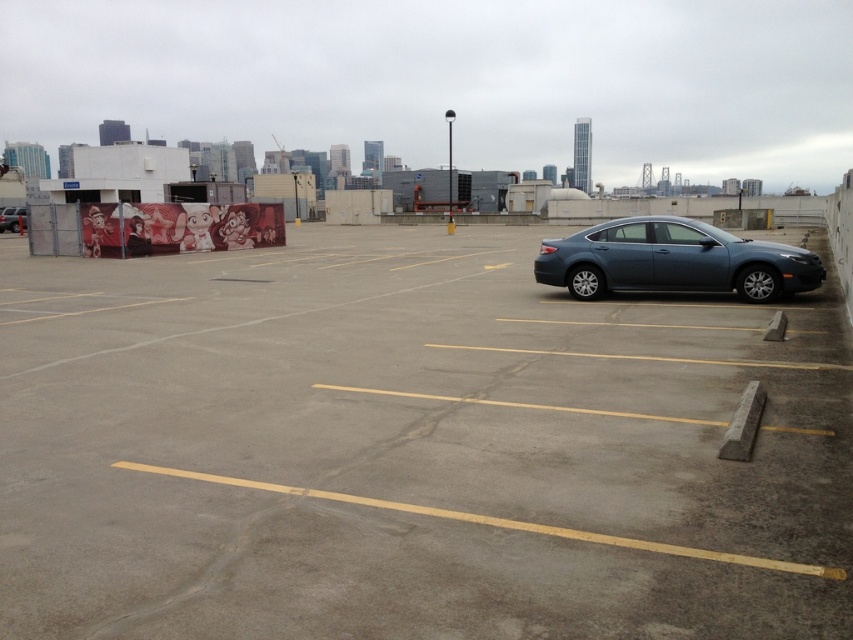
Is gray concrete parking lot at center closer to the viewer compared to satin gray sedan at right?

Yes, gray concrete parking lot at center is closer to the viewer.

Describe the element at coordinates (409, 449) in the screenshot. I see `gray concrete parking lot at center` at that location.

Find the location of a particular element. The height and width of the screenshot is (640, 853). gray concrete parking lot at center is located at coordinates (409, 449).

Does gray concrete parking lot at center appear over matte black sedan at center?

No, gray concrete parking lot at center is not above matte black sedan at center.

Who is lower down, gray concrete parking lot at center or matte black sedan at center?

gray concrete parking lot at center

Which is behind, point (61, 490) or point (22, 218)?

Positioned behind is point (22, 218).

Find the location of a particular element. This screenshot has height=640, width=853. gray concrete parking lot at center is located at coordinates (409, 449).

Is satin gray sedan at right further to the viewer compared to matte black sedan at center?

No, it is not.

The width and height of the screenshot is (853, 640). Find the location of `satin gray sedan at right`. satin gray sedan at right is located at coordinates (672, 260).